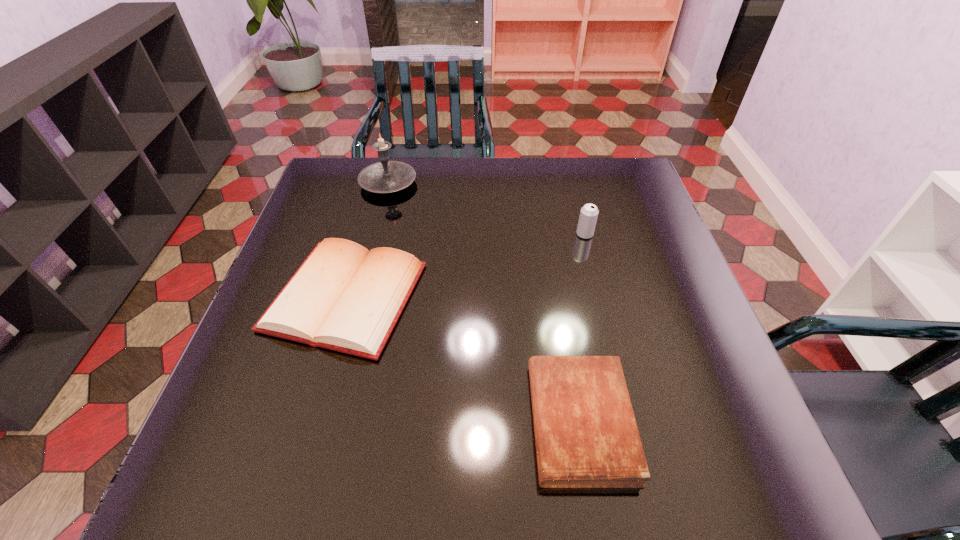
At what (x,y) coordinates should I click in order to perform the action: click on free space located 0.260m on the back of the farther Bible. Please return your answer as a coordinate pair (x, y). This screenshot has width=960, height=540. Looking at the image, I should click on (376, 187).

Identify the location of vacant space situated on the spine side of the shortest object. This screenshot has width=960, height=540. (341, 422).

Image resolution: width=960 pixels, height=540 pixels. In order to click on vacant space situated 0.270m on the spine side of the shortest object in this screenshot , I will do `click(385, 422)`.

Locate an element on the screen. The width and height of the screenshot is (960, 540). vacant space located 0.060m on the spine side of the shortest object is located at coordinates (499, 422).

Find the location of a particular element. This screenshot has height=540, width=960. object that is positioned at the far edge is located at coordinates (386, 176).

At what (x,y) coordinates should I click in order to perform the action: click on object positioned at the near edge. Please return your answer as a coordinate pair (x, y). Image resolution: width=960 pixels, height=540 pixels. Looking at the image, I should click on (586, 436).

Where is `candle that is at the left edge`? The width and height of the screenshot is (960, 540). candle that is at the left edge is located at coordinates (386, 176).

The width and height of the screenshot is (960, 540). Find the location of `Bible that is at the left edge`. Bible that is at the left edge is located at coordinates (344, 298).

Find the location of `object present at the far left corner`. object present at the far left corner is located at coordinates (386, 176).

In the image, there is a desktop. Where is `free space at the far edge`? free space at the far edge is located at coordinates (505, 168).